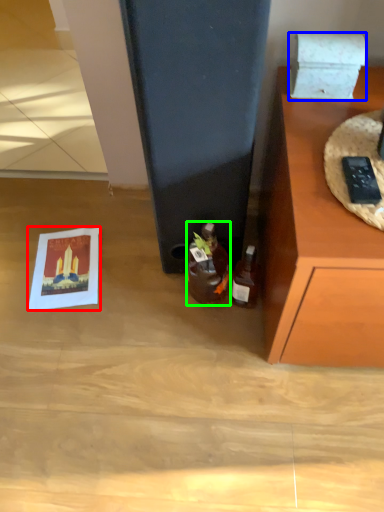
Question: Which object is positioned closest to postcard (highlighted by a red box)? Select from box (highlighted by a blue box) and bottle (highlighted by a green box).

Choices:
 (A) box
 (B) bottle

Answer: (B)